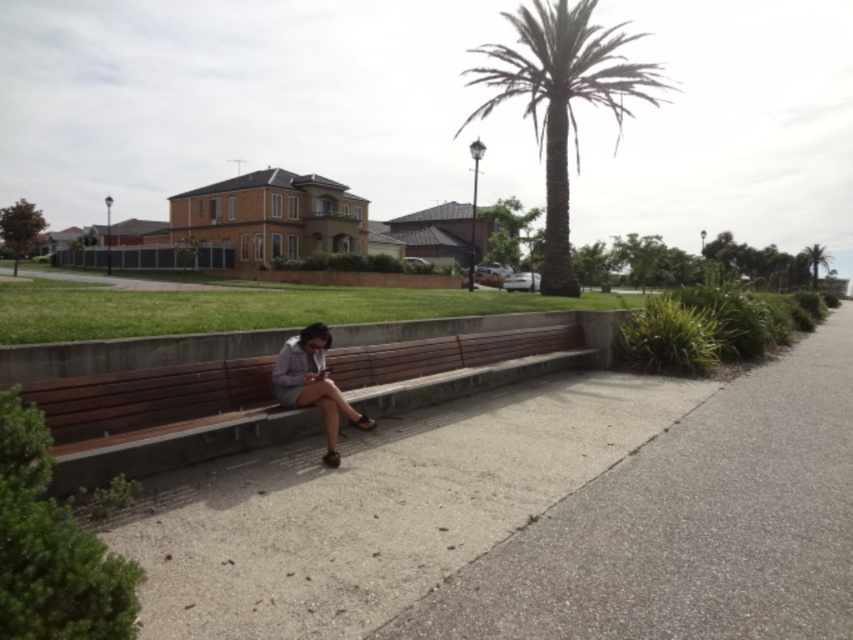
You are a delivery robot with a 1 meter wide package. You need to travel along the gray concrete pavement at center while avoiding the matte gray shirt at center. Can you fit through the space between them?

The gray concrete pavement at center might be wider than matte gray shirt at center, so there is a possibility that the delivery robot with a 1 meter wide package can fit through the space between them. However, the exact width difference is uncertain based on the available information.